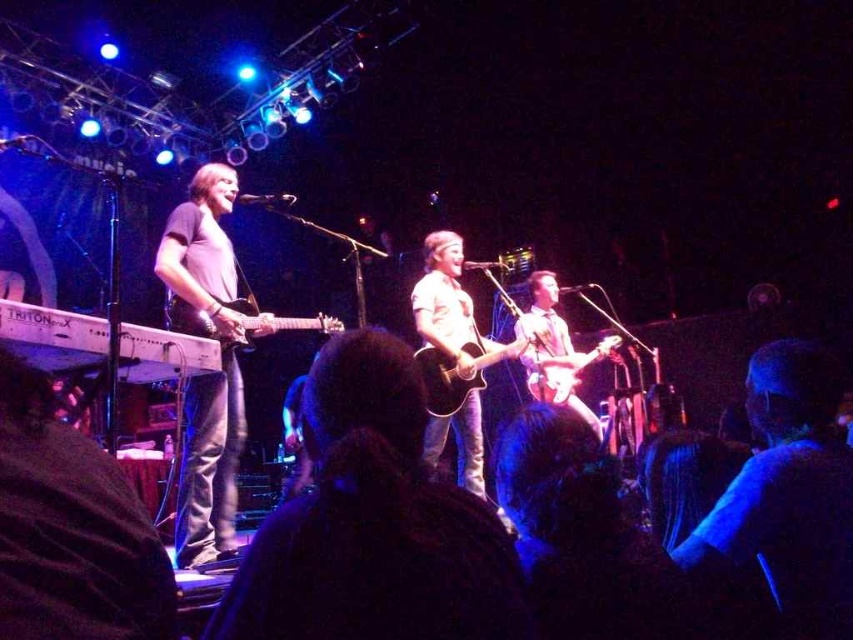
Question: Can you confirm if blue fabric shirt at center is positioned to the left of matte black guitar at left?

Choices:
 (A) yes
 (B) no

Answer: (B)

Question: Which object appears farthest from the camera in this image?

Choices:
 (A) matte black guitar at left
 (B) blue fabric shirt at center

Answer: (A)

Question: Which of the following is the closest to the observer?

Choices:
 (A) (425, 429)
 (B) (254, 332)
 (C) (202, 209)

Answer: (A)

Question: Is matte black guitar at left below matte brown guitar at center?

Choices:
 (A) no
 (B) yes

Answer: (A)

Question: Which object is farther from the camera taking this photo?

Choices:
 (A) matte black guitar at left
 (B) blue fabric shirt at center

Answer: (A)

Question: Is acoustic wood guitar at center wider than matte black electric guitar at left?

Choices:
 (A) yes
 (B) no

Answer: (A)